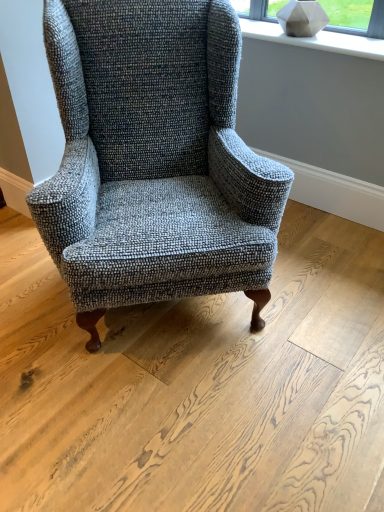
This screenshot has width=384, height=512. What are the coordinates of `free point above white matte stone at upper center (from a real-world perspective)` in the screenshot? It's located at (319, 34).